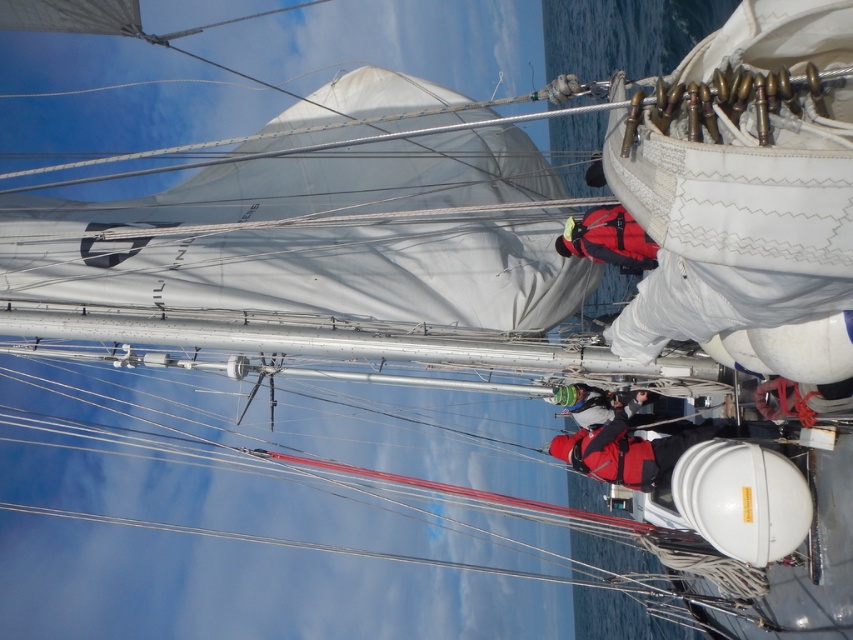
Does red fabric jacket at center lie behind green knitted hat at center?

No, it is in front of green knitted hat at center.

Can you confirm if red fabric jacket at center is positioned to the right of green knitted hat at center?

Correct, you'll find red fabric jacket at center to the right of green knitted hat at center.

Identify the location of red fabric jacket at center. This screenshot has width=853, height=640. (630, 451).